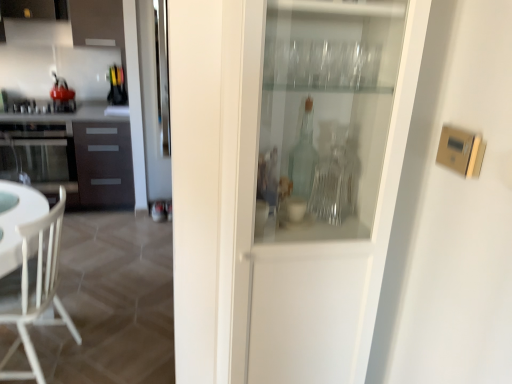
Identify the location of spots to the right of shiny red kettle at left, which ranks as the first appliance in top-to-bottom order. The height and width of the screenshot is (384, 512). (90, 105).